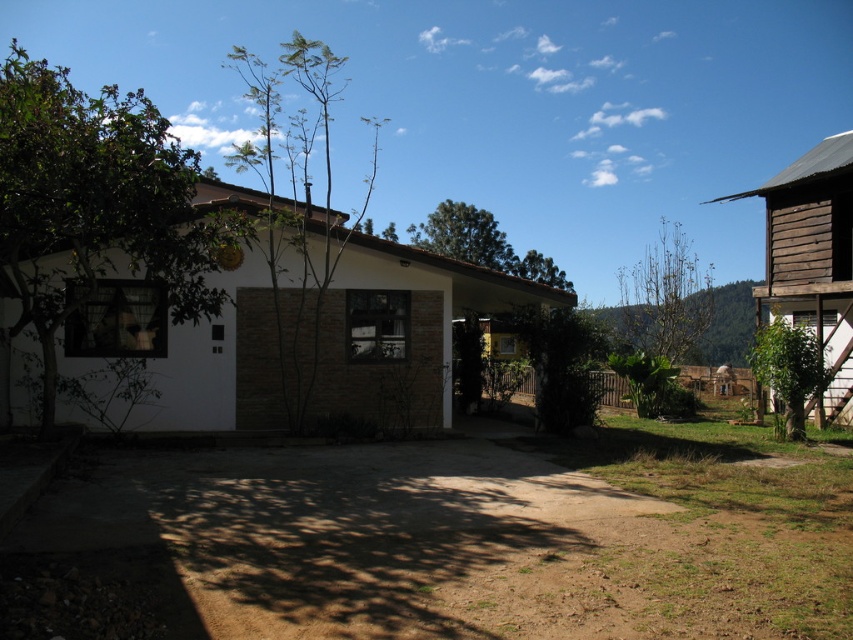
Consider the image. Who is positioned more to the left, white brick house at left or green leafy tree at left?

Positioned to the left is green leafy tree at left.

From the picture: Is white brick house at left further to camera compared to green leafy tree at left?

That is True.

This screenshot has height=640, width=853. What do you see at coordinates (305, 337) in the screenshot? I see `white brick house at left` at bounding box center [305, 337].

Where is `white brick house at left`? This screenshot has width=853, height=640. white brick house at left is located at coordinates (305, 337).

Does wooden hut at right have a greater width compared to green leafy tree at right?

Indeed, wooden hut at right has a greater width compared to green leafy tree at right.

Between point (845, 337) and point (809, 397), which one is positioned in front?

Positioned in front is point (809, 397).

Where is `wooden hut at right`? wooden hut at right is located at coordinates (811, 260).

Is green leafy tree at left positioned in front of green leafy tree at right?

That is True.

Can you confirm if green leafy tree at left is smaller than green leafy tree at right?

No.

Who is more distant from viewer, (80, 285) or (799, 333)?

Point (799, 333)

This screenshot has height=640, width=853. Identify the location of green leafy tree at left. (91, 204).